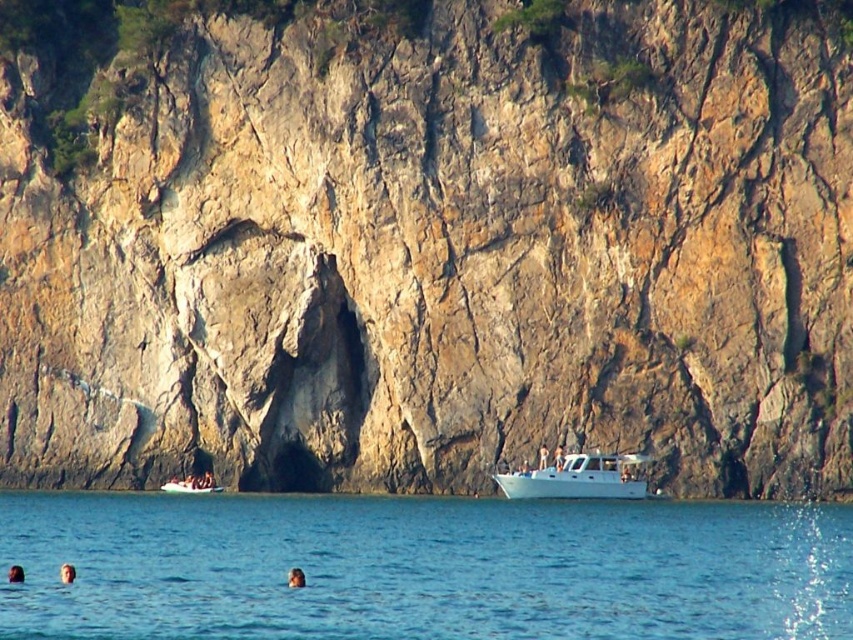
Question: Does blue water at lower center come in front of white matte boat at lower left?

Choices:
 (A) no
 (B) yes

Answer: (B)

Question: Which object appears closest to the camera in this image?

Choices:
 (A) smooth skin face at lower center
 (B) white matte boat at lower left

Answer: (A)

Question: Estimate the real-world distances between objects in this image. Which object is farther from the smooth skin head at lower left?

Choices:
 (A) white matte boat at lower left
 (B) blue water at lower center
 (C) smooth skin head at lower center
 (D) smooth skin face at lower center

Answer: (A)

Question: Does blue water at lower center appear under white matte person at lower center?

Choices:
 (A) no
 (B) yes

Answer: (B)

Question: Among these points, which one is nearest to the camera?

Choices:
 (A) (299, 579)
 (B) (73, 576)
 (C) (19, 570)

Answer: (A)

Question: Does smooth skin face at lower center appear on the left side of smooth skin head at lower left?

Choices:
 (A) yes
 (B) no

Answer: (B)